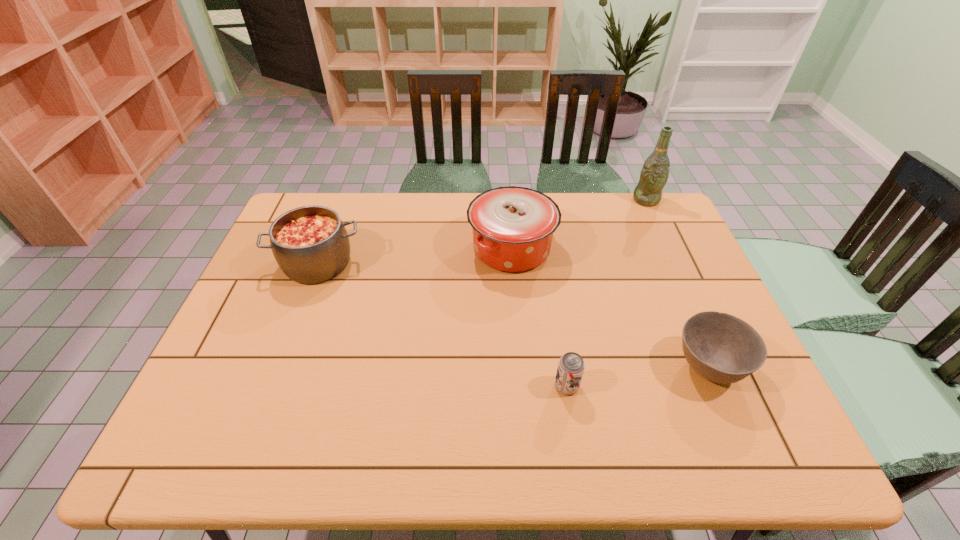
Where is `free space located on the right of the shorter casserole`? The height and width of the screenshot is (540, 960). free space located on the right of the shorter casserole is located at coordinates (400, 263).

Image resolution: width=960 pixels, height=540 pixels. Find the location of `free region located on the left of the bowl`. free region located on the left of the bowl is located at coordinates (518, 367).

Identify the location of vacant position located 0.260m on the right of the beer can. (690, 386).

Where is `beer bottle that is at the far edge`? The height and width of the screenshot is (540, 960). beer bottle that is at the far edge is located at coordinates (655, 172).

Find the location of a particular element. casserole that is at the far edge is located at coordinates (513, 227).

Locate an element on the screen. object that is positioned at the left edge is located at coordinates (310, 244).

Find the location of a particular element. Image resolution: width=960 pixels, height=540 pixels. beer bottle situated at the right edge is located at coordinates click(x=655, y=172).

Where is `bowl present at the right edge`? bowl present at the right edge is located at coordinates point(721,348).

Image resolution: width=960 pixels, height=540 pixels. I want to click on object that is at the far right corner, so click(x=655, y=172).

You are a GUI agent. You are given a task and a screenshot of the screen. Output one action in this format:
    pyautogui.click(x=<x>, y=<y>)
    Task: Click on the free location at the far edge
    Image resolution: width=960 pixels, height=540 pixels.
    Given the screenshot: What is the action you would take?
    pyautogui.click(x=396, y=207)